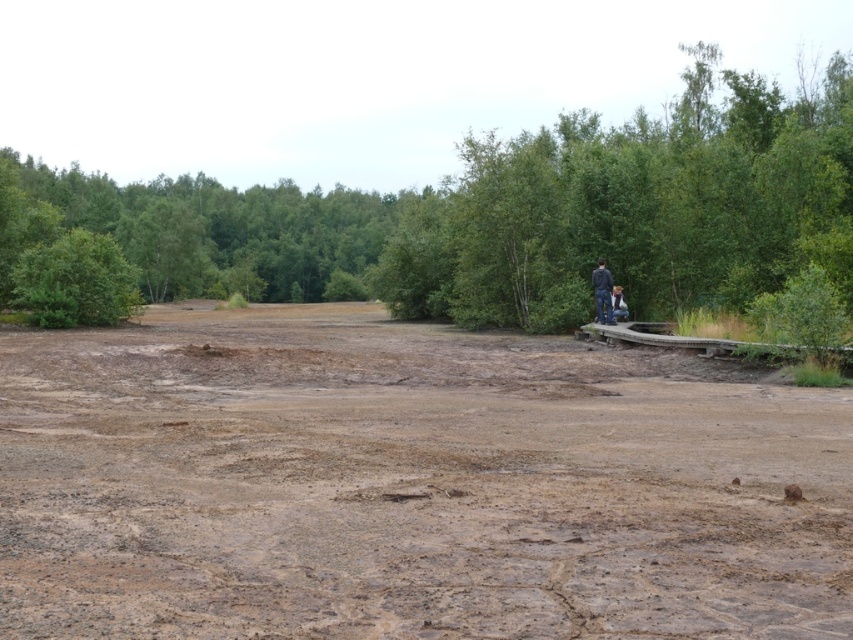
Does green leafy forest at center appear over dark blue jeans at center?

Correct, green leafy forest at center is located above dark blue jeans at center.

Describe the element at coordinates (521, 214) in the screenshot. I see `green leafy forest at center` at that location.

The width and height of the screenshot is (853, 640). Identify the location of green leafy forest at center. (521, 214).

Who is more forward, (683,384) or (608,305)?

Positioned in front is point (683,384).

Does brown textured dirt field at center come in front of dark blue jeans at center-right?

That is True.

Identify the location of brown textured dirt field at center. Image resolution: width=853 pixels, height=640 pixels. (408, 484).

At what (x,y) coordinates should I click in order to perform the action: click on brown textured dirt field at center. Please return your answer as a coordinate pair (x, y). The image size is (853, 640). Looking at the image, I should click on (408, 484).

Can you confirm if brown textured dirt field at center is smaller than dark blue jeans at center?

No, brown textured dirt field at center is not smaller than dark blue jeans at center.

Who is higher up, brown textured dirt field at center or dark blue jeans at center?

Positioned higher is dark blue jeans at center.

You are a GUI agent. You are given a task and a screenshot of the screen. Output one action in this format:
    pyautogui.click(x=<x>, y=<y>)
    Task: Click on the brown textured dirt field at center
    
    Given the screenshot: What is the action you would take?
    pyautogui.click(x=408, y=484)